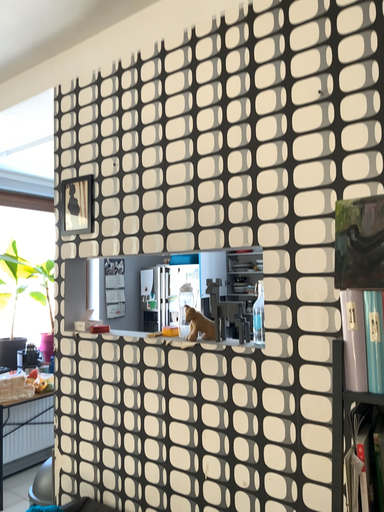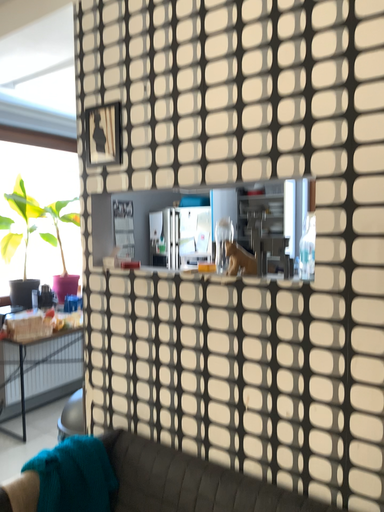
Question: Which way did the camera rotate in the video?

Choices:
 (A) rotated upward
 (B) rotated downward

Answer: (B)